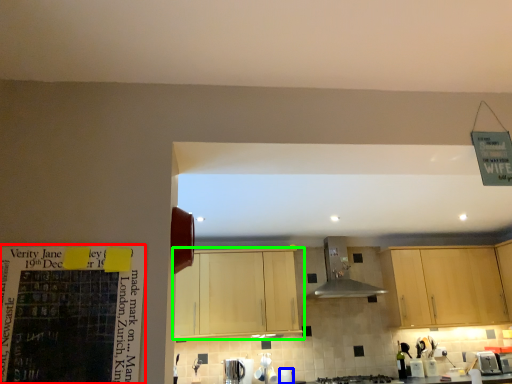
Question: Based on their relative distances, which object is farther from bulletin board (highlighted by a red box)? Choose from appliance (highlighted by a blue box) and cabinetry (highlighted by a green box).

Choices:
 (A) appliance
 (B) cabinetry

Answer: (A)